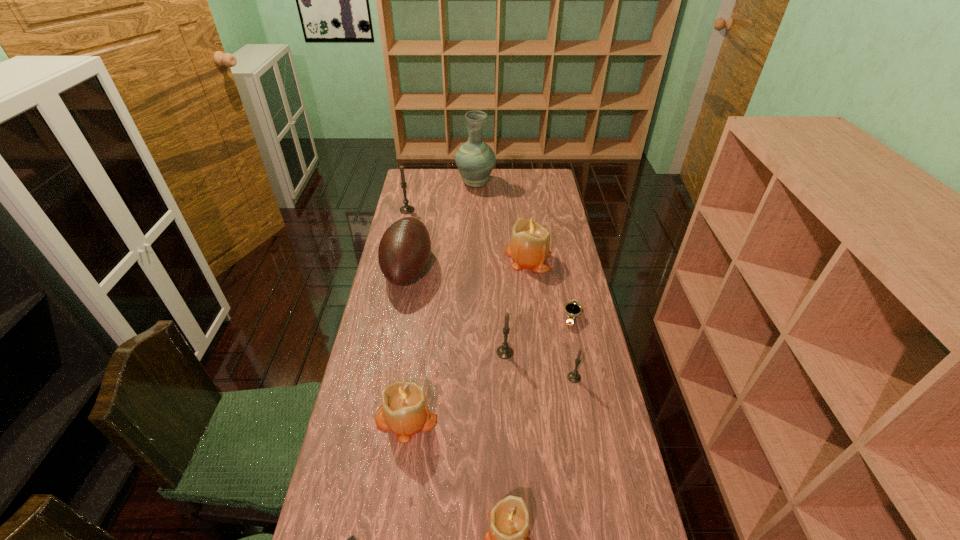
Select which gray candle is the second closest to the leftmost gray candle. Please provide its 2D coordinates. Your answer should be formatted as a tuple, i.e. [(x, y)], where the tuple contains the x and y coordinates of a point satisfying the conditions above.

[(574, 377)]

Identify the location of gray candle that is the nearest to the watch. (574, 377).

What are the coordinates of `beige candle object that ranks as the second closest to the second smallest gray candle` in the screenshot? It's located at (529, 248).

Locate which beige candle is the second closest to the watch. Please provide its 2D coordinates. Your answer should be formatted as a tuple, i.e. [(x, y)], where the tuple contains the x and y coordinates of a point satisfying the conditions above.

[(404, 410)]

Find the location of a particular element. free spot that satisfies the following two spatial constraints: 1. on the front side of the farthest beige candle; 2. on the left side of the seventh farthest object is located at coordinates (543, 377).

At what (x,y) coordinates should I click in order to perform the action: click on free spot that satisfies the following two spatial constraints: 1. on the back side of the fifth nearest candle; 2. on the left side of the second smallest gray candle. Please return your answer as a coordinate pair (x, y). Looking at the image, I should click on (500, 257).